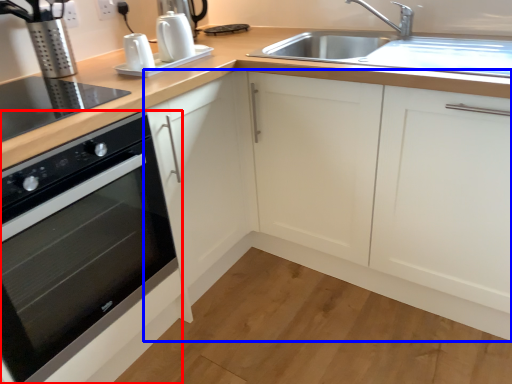
Question: Which of the following is the closest to the observer, home appliance (highlighted by a red box) or cabinetry (highlighted by a blue box)?

Choices:
 (A) home appliance
 (B) cabinetry

Answer: (A)